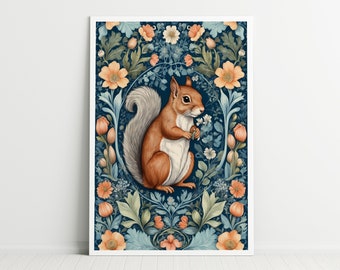
Where is `painting`? The height and width of the screenshot is (270, 340). painting is located at coordinates (173, 149).